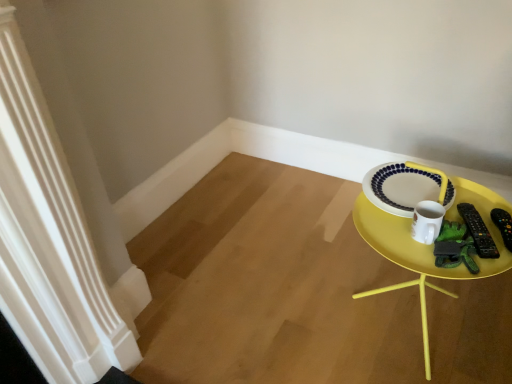
Question: From the image's perspective, is black plastic remote control at right, the second remote control from the left, positioned above or below white glossy mug at right?

Choices:
 (A) above
 (B) below

Answer: (B)

Question: Is black plastic remote control at right, the second remote control from the left, in front of or behind white glossy mug at right in the image?

Choices:
 (A) behind
 (B) front

Answer: (A)

Question: Which object is the closest to the yellow plastic tray at right?

Choices:
 (A) black plastic remote control at right, the 1th remote control in the right-to-left sequence
 (B) white glossy mug at right
 (C) black plastic remote control at right, which is the second remote control from right to left
 (D) white glossy plate at upper right

Answer: (B)

Question: Based on their relative distances, which object is farther from the black plastic remote control at right, the second remote control from the left?

Choices:
 (A) yellow plastic tray at right
 (B) white glossy plate at upper right
 (C) white glossy mug at right
 (D) black plastic remote control at right, the 1th remote control from the left

Answer: (B)